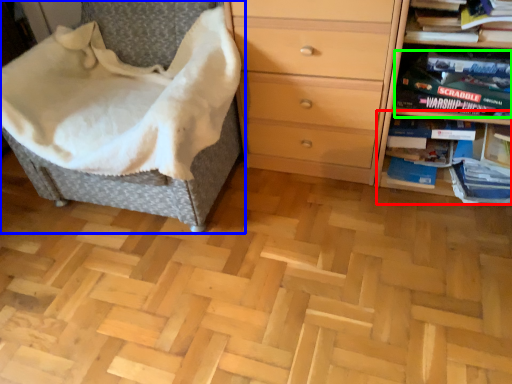
Question: Considering the real-world distances, which object is closest to shelf (highlighted by a red box)? furniture (highlighted by a blue box) or paperback book (highlighted by a green box).

Choices:
 (A) furniture
 (B) paperback book

Answer: (B)